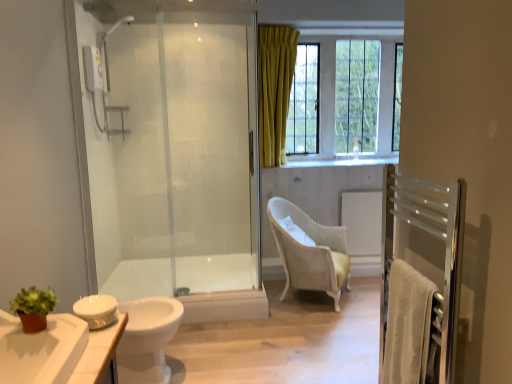
What do you see at coordinates (173, 157) in the screenshot? This screenshot has height=384, width=512. I see `transparent glass shower door at left` at bounding box center [173, 157].

In order to click on white glossy bathtub at center in this screenshot , I will do `click(195, 285)`.

The height and width of the screenshot is (384, 512). Describe the element at coordinates (56, 350) in the screenshot. I see `white glossy cabinet at lower left` at that location.

You are a GUI agent. You are given a task and a screenshot of the screen. Output one action in this format:
    pyautogui.click(x=<x>, y=<y>)
    Task: Click on the matte glass window at upper right
    Image resolution: width=512 pixels, height=384 pixels.
    Given the screenshot: What is the action you would take?
    pyautogui.click(x=335, y=92)

Could you tell me if white glossy cabinet at lower left is facing white glossy toilet at lower left?

No, white glossy cabinet at lower left does not turn towards white glossy toilet at lower left.

Is white glossy cabinet at lower left outside of white glossy toilet at lower left?

Yes, white glossy cabinet at lower left is located beyond the bounds of white glossy toilet at lower left.

Does white glossy cabinet at lower left have a greater width compared to white glossy toilet at lower left?

No, white glossy cabinet at lower left is not wider than white glossy toilet at lower left.

Is white glossy cabinet at lower left bigger or smaller than white glossy toilet at lower left?

Considering their sizes, white glossy cabinet at lower left takes up less space than white glossy toilet at lower left.

Considering their positions, is white wicker chair at center located in front of or behind matte glass window at upper right?

In the image, white wicker chair at center appears in front of matte glass window at upper right.

From the image's perspective, is white wicker chair at center beneath matte glass window at upper right?

Yes, from the image's perspective, white wicker chair at center is beneath matte glass window at upper right.

Is there a large distance between white wicker chair at center and matte glass window at upper right?

Indeed, white wicker chair at center is not near matte glass window at upper right.

Is transparent glass shower door at left at the back of white glossy bathtub at center?

No, white glossy bathtub at center's orientation is not away from transparent glass shower door at left.

Can we say white glossy bathtub at center lies outside transparent glass shower door at left?

white glossy bathtub at center lies outside transparent glass shower door at left's area.

From the image's perspective, which is above, white glossy bathtub at center or transparent glass shower door at left?

transparent glass shower door at left appears higher in the image.

From a real-world perspective, who is located lower, white glossy bathtub at center or transparent glass shower door at left?

white glossy bathtub at center is physically lower.

From their relative heights in the image, would you say matte glass window at upper right is taller or shorter than white glossy faucet at upper center?

matte glass window at upper right is taller than white glossy faucet at upper center.

Which object is further away from the camera taking this photo, matte glass window at upper right or white glossy faucet at upper center?

Positioned behind is white glossy faucet at upper center.

From a real-world perspective, is matte glass window at upper right located higher than white glossy faucet at upper center?

Yes.

Is white wicker chair at center oriented towards transparent glass shower door at left?

No, white wicker chair at center is not oriented towards transparent glass shower door at left.

Is the depth of white wicker chair at center greater than that of transparent glass shower door at left?

No, white wicker chair at center is closer to the camera.

From the image's perspective, is white wicker chair at center above or below transparent glass shower door at left?

white wicker chair at center is situated lower than transparent glass shower door at left in the image.

Considering the sizes of white wicker chair at center and transparent glass shower door at left in the image, is white wicker chair at center wider or thinner than transparent glass shower door at left?

Clearly, white wicker chair at center has more width compared to transparent glass shower door at left.

Which is less distant, (356, 143) or (86, 340)?

Positioned in front is point (86, 340).

In the image, is white glossy faucet at upper center on the left side or the right side of white glossy cabinet at lower left?

white glossy faucet at upper center is positioned on white glossy cabinet at lower left's right side.

From a real-world perspective, is white glossy faucet at upper center below white glossy cabinet at lower left?

No, from a real-world perspective, white glossy faucet at upper center is not under white glossy cabinet at lower left.

From their relative heights in the image, would you say white glossy faucet at upper center is taller or shorter than white glossy cabinet at lower left?

In the image, white glossy faucet at upper center appears to be shorter than white glossy cabinet at lower left.

Looking at this image, is white glossy faucet at upper center a part of transparent glass shower door at left?

No.

From a real-world perspective, is transparent glass shower door at left above or below white glossy faucet at upper center?

Clearly, from a real-world perspective, transparent glass shower door at left is above white glossy faucet at upper center.

Between transparent glass shower door at left and white glossy faucet at upper center, which one appears on the left side from the viewer's perspective?

transparent glass shower door at left is more to the left.

Image resolution: width=512 pixels, height=384 pixels. I want to click on toilet below the white glossy cabinet at lower left (from the image's perspective), so [x=147, y=339].

Locate an element on the screen. This screenshot has width=512, height=384. window above the white wicker chair at center (from the image's perspective) is located at coordinates (335, 92).

Looking at this image, based on their spatial positions, is white wicker chair at center or white glossy faucet at upper center further from white glossy cabinet at lower left?

Based on the image, white glossy faucet at upper center appears to be further to white glossy cabinet at lower left.

Estimate the real-world distances between objects in this image. Which object is closer to white wicker chair at center, white glossy cabinet at lower left or white glossy faucet at upper center?

Among the two, white glossy faucet at upper center is located nearer to white wicker chair at center.

Which object lies further to the anchor point white wicker chair at center, white glossy bathtub at center or white glossy faucet at upper center?

white glossy faucet at upper center lies further to white wicker chair at center than the other object.

Looking at the image, which one is located closer to white wicker chair at center, white glossy bathtub at center or white glossy toilet at lower left?

white glossy bathtub at center is positioned closer to the anchor white wicker chair at center.

Looking at the image, which one is located closer to white glossy toilet at lower left, matte glass window at upper right or white glossy cabinet at lower left?

The object closer to white glossy toilet at lower left is white glossy cabinet at lower left.

From the image, which object appears to be nearer to white wicker chair at center, white glossy toilet at lower left or transparent glass shower door at left?

Among the two, transparent glass shower door at left is located nearer to white wicker chair at center.

Looking at the image, which one is located closer to white wicker chair at center, white glossy bathtub at center or transparent glass shower door at left?

The object closer to white wicker chair at center is white glossy bathtub at center.

Considering their positions, is white glossy faucet at upper center positioned further to white glossy bathtub at center than transparent glass shower door at left?

white glossy faucet at upper center.

In order to click on bath between white glossy cabinet at lower left and white glossy faucet at upper center in the front-back direction in this screenshot , I will do `click(195, 285)`.

You are a GUI agent. You are given a task and a screenshot of the screen. Output one action in this format:
    pyautogui.click(x=<x>, y=<y>)
    Task: Click on the window between white glossy bathtub at center and white glossy faucet at upper center from left to right
    The height and width of the screenshot is (384, 512).
    Given the screenshot: What is the action you would take?
    pyautogui.click(x=335, y=92)

You are a GUI agent. You are given a task and a screenshot of the screen. Output one action in this format:
    pyautogui.click(x=<x>, y=<y>)
    Task: Click on the chair between white glossy cabinet at lower left and white glossy bathtub at center from front to back
    
    Given the screenshot: What is the action you would take?
    click(x=310, y=252)

Locate an element on the screen. The image size is (512, 384). bath between white glossy toilet at lower left and transparent glass shower door at left in the front-back direction is located at coordinates (195, 285).